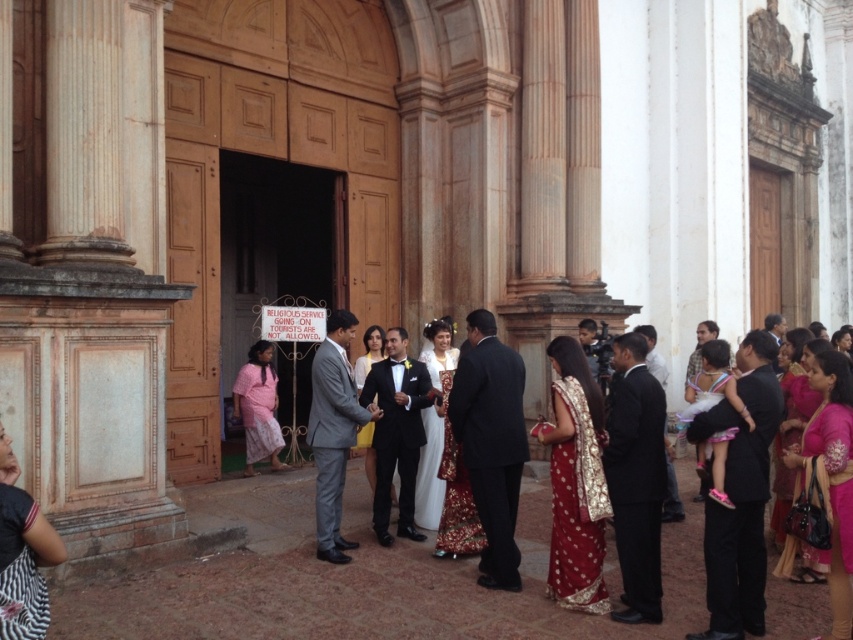
Question: Based on their relative distances, which object is nearer to the black satin tuxedo at center?

Choices:
 (A) dark blue suit at center
 (B) zebra print dress at lower left
 (C) black satin suit at right

Answer: (A)

Question: Is red silk saree at center to the right of black satin tuxedo at center from the viewer's perspective?

Choices:
 (A) yes
 (B) no

Answer: (A)

Question: Does dark blue suit at center have a larger size compared to gray suit at center?

Choices:
 (A) no
 (B) yes

Answer: (A)

Question: Estimate the real-world distances between objects in this image. Which object is closer to the red silk saree at center?

Choices:
 (A) black satin tuxedo at center
 (B) dark blue suit at right
 (C) dark blue suit at center

Answer: (C)

Question: Estimate the real-world distances between objects in this image. Which object is farther from the zebra print dress at lower left?

Choices:
 (A) pink cotton saree at lower left
 (B) dark blue suit at center
 (C) red silk saree at center

Answer: (A)

Question: Does dark blue suit at right have a lesser width compared to pink cotton saree at lower left?

Choices:
 (A) yes
 (B) no

Answer: (A)